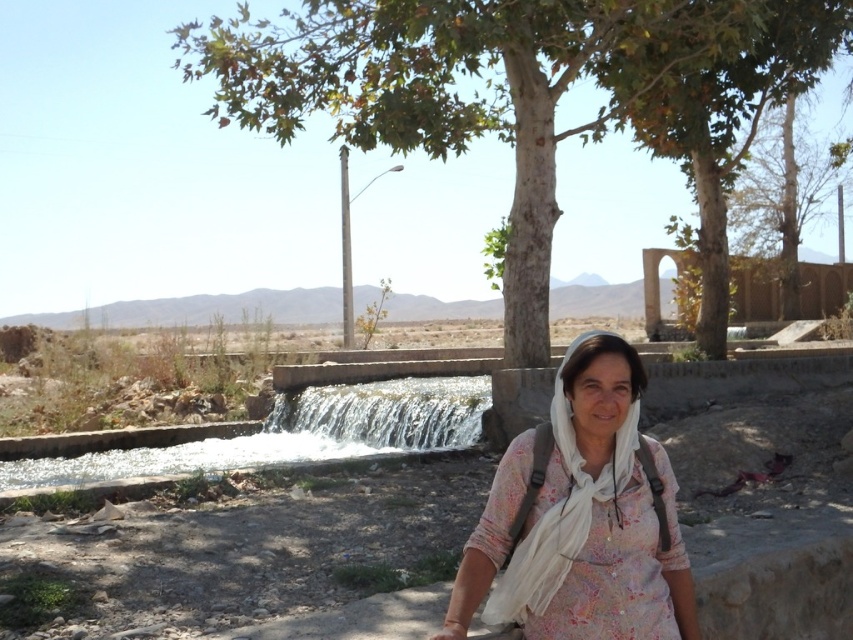
You are a photographer trying to capture the green leafy tree at center and the white floral shirt at center in a single shot. Which object should you focus on first to ensure both are in the frame?

You should focus on the green leafy tree at center first because it is closer to you than the white floral shirt at center, ensuring both are in the frame.